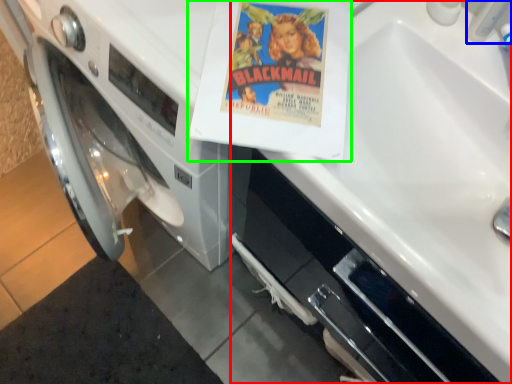
Question: Which object is the closest to the sink (highlighted by a red box)? Choose among these: faucet (highlighted by a blue box) or paperback book (highlighted by a green box).

Choices:
 (A) faucet
 (B) paperback book

Answer: (B)